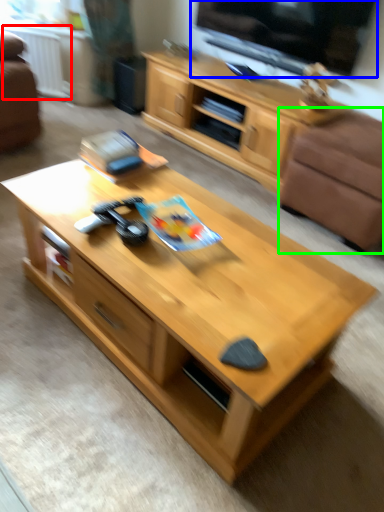
Question: Estimate the real-world distances between objects in this image. Which object is closer to radiator (highlighted by a red box), window screen (highlighted by a blue box) or armchair (highlighted by a green box)?

Choices:
 (A) window screen
 (B) armchair

Answer: (A)